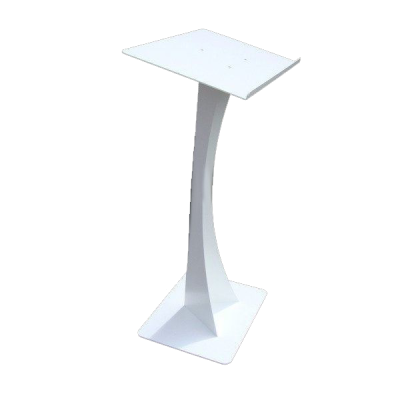
This screenshot has height=400, width=400. What are the coordinates of `front of podium` in the screenshot? It's located at (91, 263).